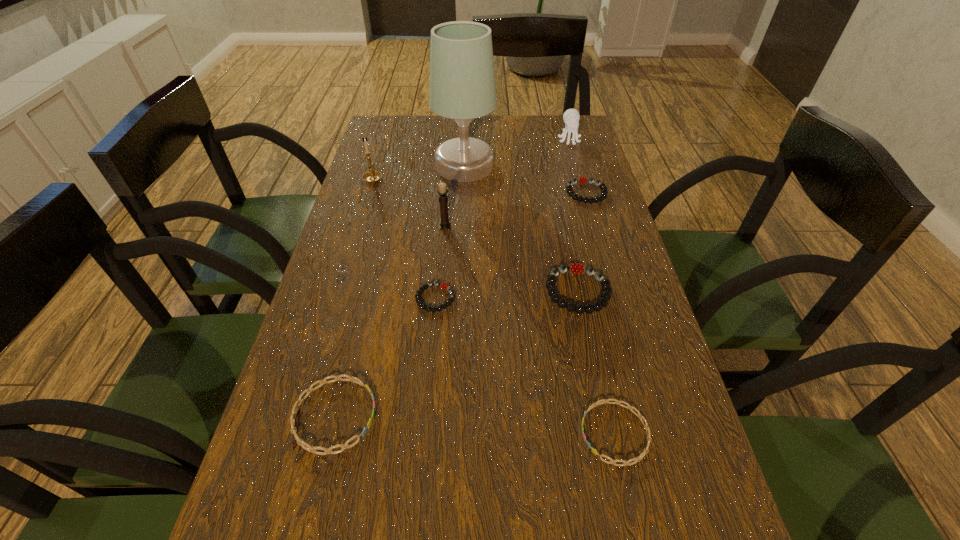
Identify the location of free space between the biggest black bracelet and the nearer candle holder. This screenshot has width=960, height=540. (512, 259).

Locate an element on the screen. The image size is (960, 540). free spot between the biggest black bracelet and the left candle holder is located at coordinates click(475, 234).

Locate an element on the screen. This screenshot has height=540, width=960. vacant space that's between the leftmost black bracelet and the fifth nearest object is located at coordinates (441, 262).

The height and width of the screenshot is (540, 960). Identify the location of unoccupied position between the fifth farthest object and the lampshade. (455, 195).

The width and height of the screenshot is (960, 540). Find the location of `vacant area between the farthest black bracelet and the farthest object`. vacant area between the farthest black bracelet and the farthest object is located at coordinates (578, 166).

I want to click on free space between the smaller blue bracelet and the gray lampshade, so click(x=540, y=299).

Locate an element on the screen. Image resolution: width=960 pixels, height=540 pixels. vacant space in between the white octopus and the farthest black bracelet is located at coordinates (578, 166).

Find the location of a particular element. The height and width of the screenshot is (540, 960). free space between the biggest black bracelet and the smaller blue bracelet is located at coordinates (596, 362).

You are a GUI agent. You are given a task and a screenshot of the screen. Output one action in this format:
    pyautogui.click(x=<x>, y=<y>)
    Task: Click on the object identified as the seventh closest to the tallest object
    The width and height of the screenshot is (960, 540).
    Given the screenshot: What is the action you would take?
    pyautogui.click(x=312, y=449)

The height and width of the screenshot is (540, 960). I want to click on the fourth closest object to the white octopus, so click(576, 268).